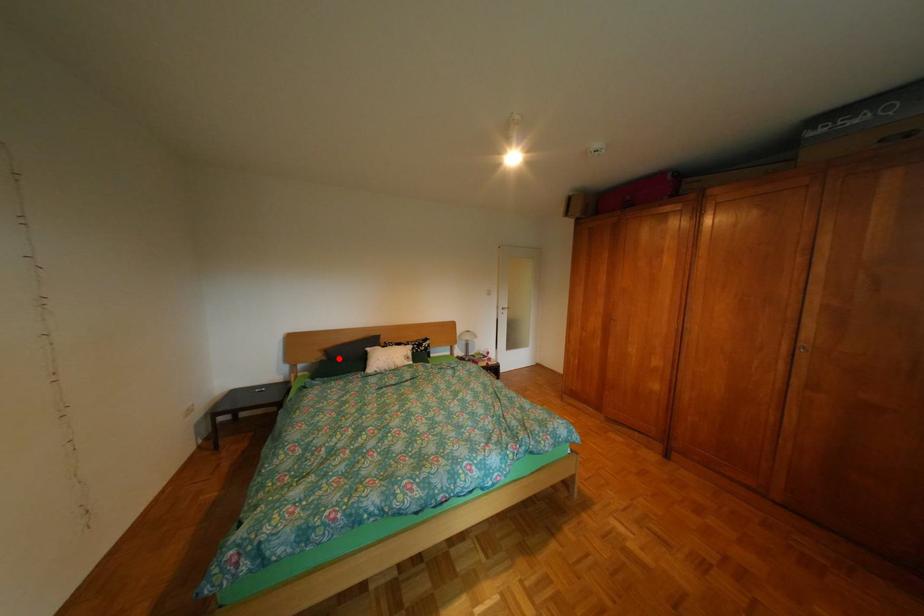
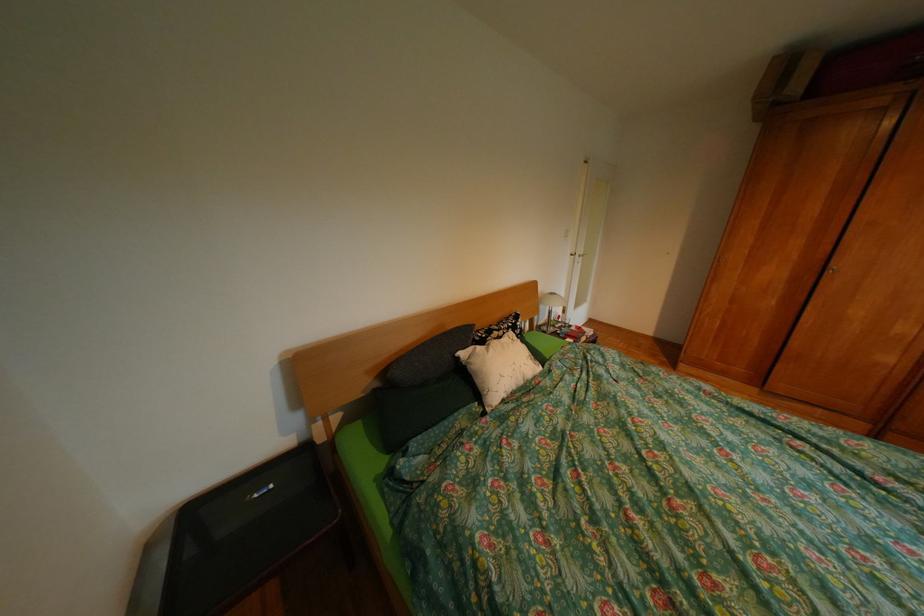
Question: I am providing you with two images of the same scene from different viewpoints. A red point is shown in image1. For the corresponding object point in image2, is it positioned nearer or farther from the camera?

Choices:
 (A) Nearer
 (B) Farther

Answer: (B)